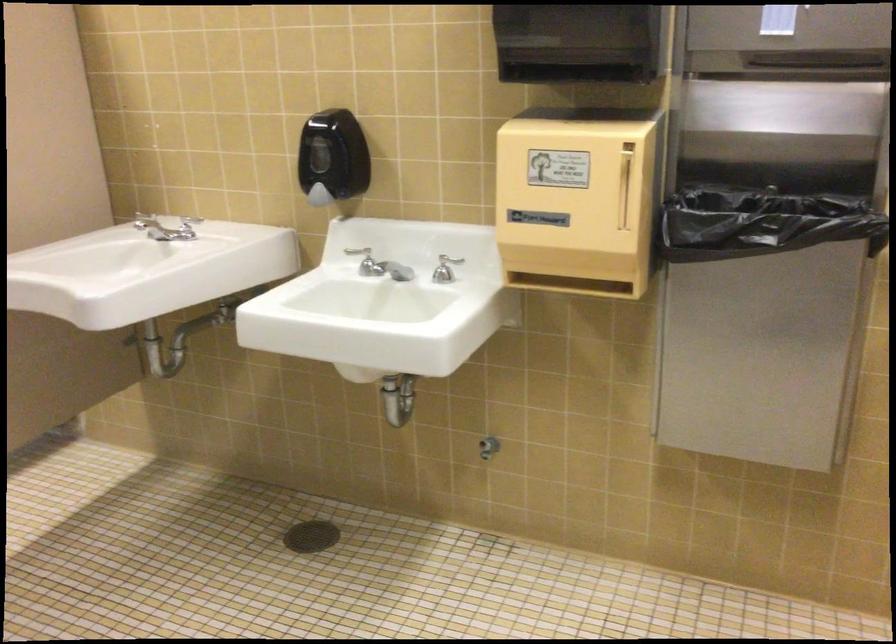
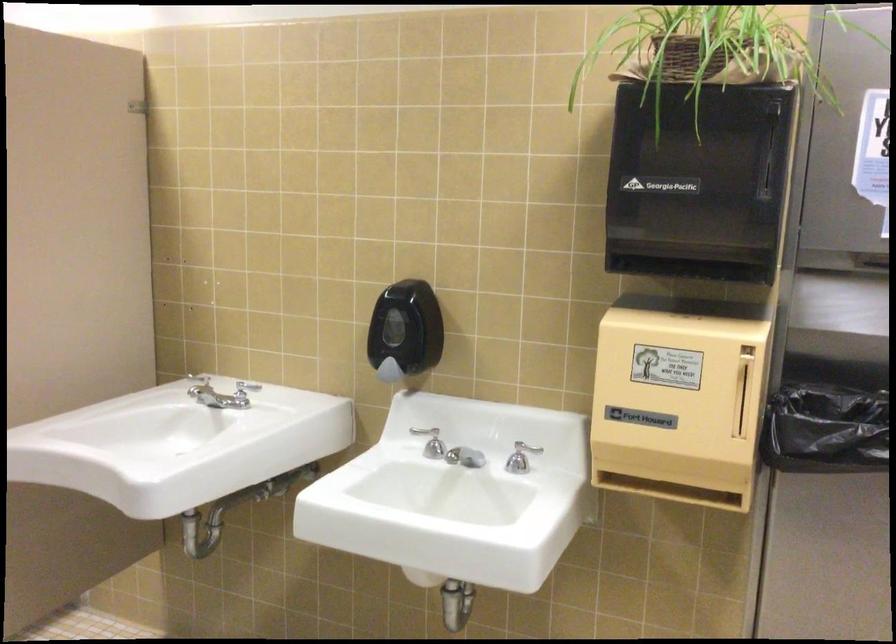
In the second image, find the point that corresponds to point 365,267 in the first image.

(433, 444)